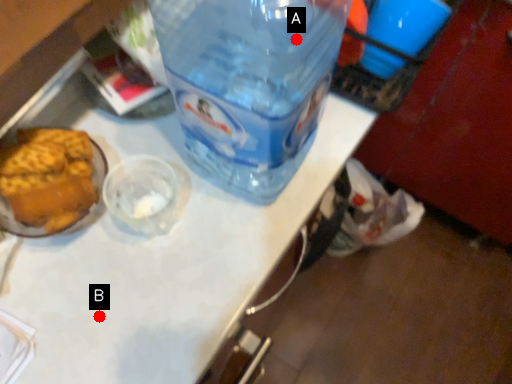
Question: Two points are circled on the image, labeled by A and B beside each circle. Which point appears farthest from the camera in this image?

Choices:
 (A) A is further
 (B) B is further

Answer: (B)